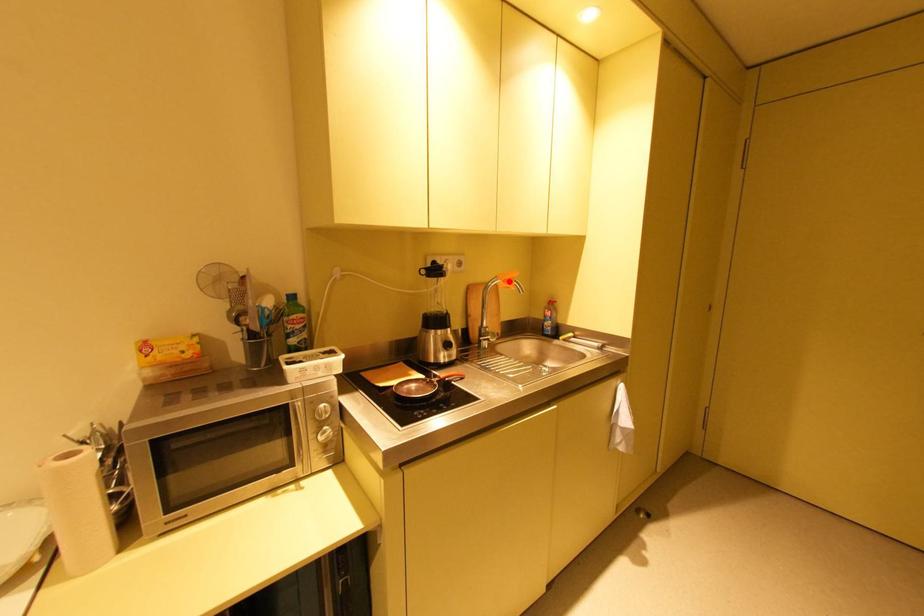
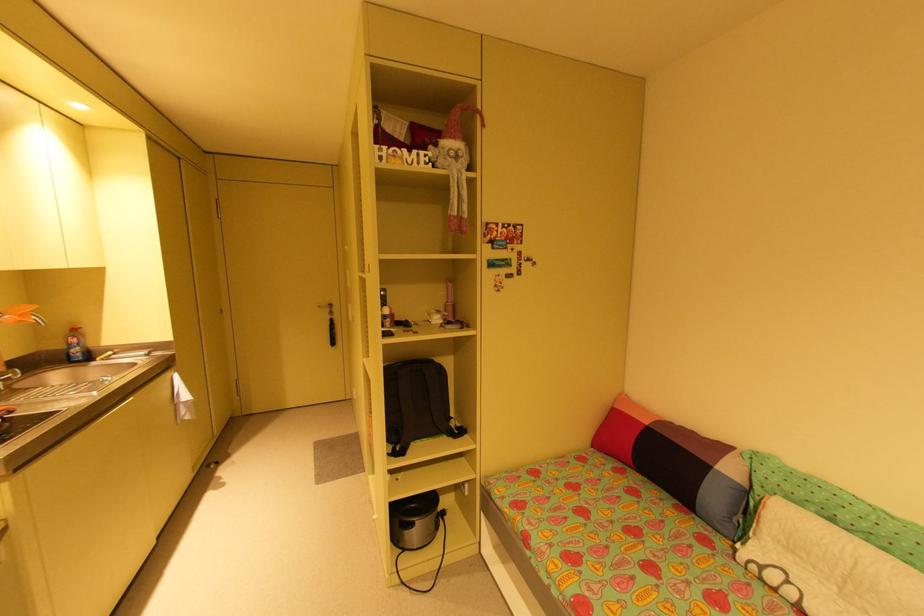
In the second image, find the point that corresponds to the highlighted location in the first image.

(25, 315)